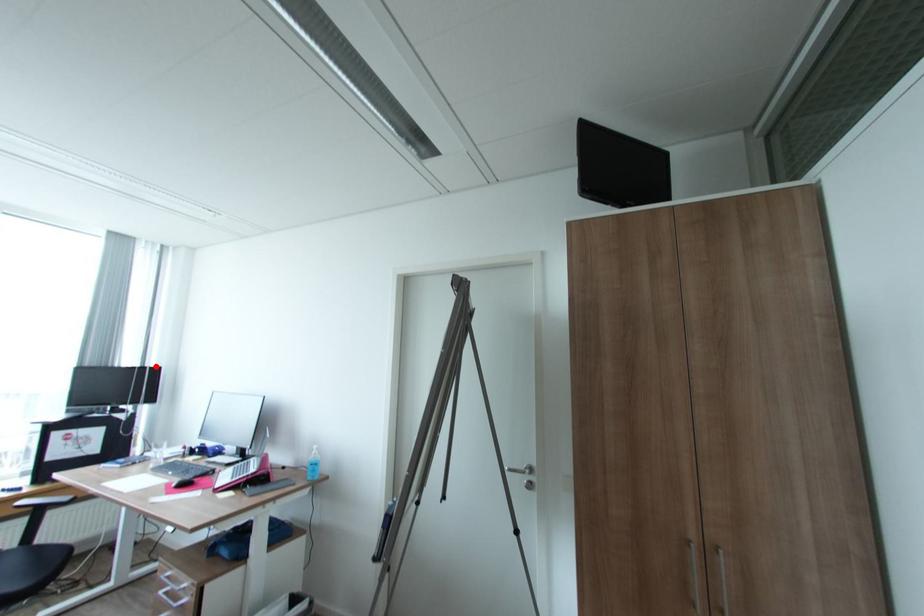
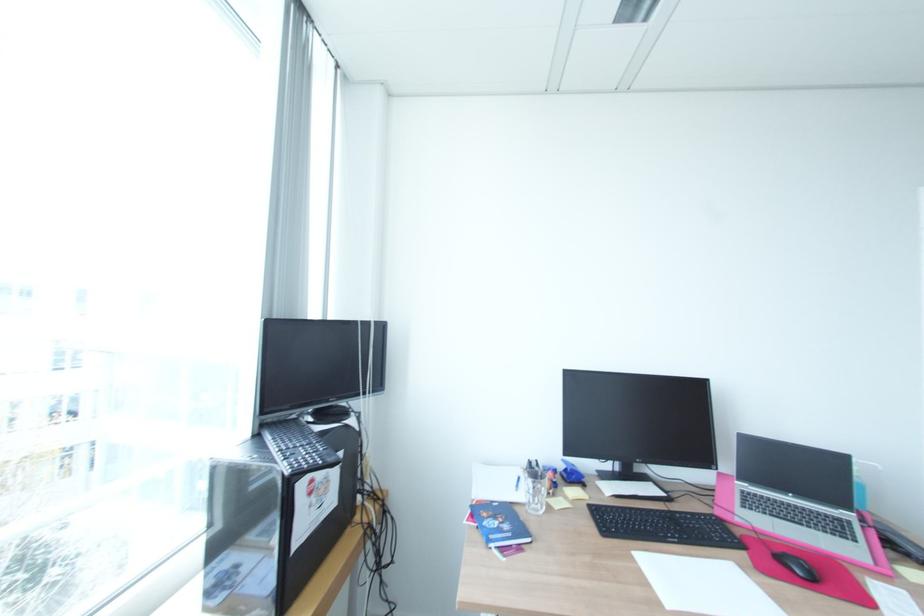
Locate, in the second image, the point that corresponds to the highlighted location in the first image.

(381, 321)